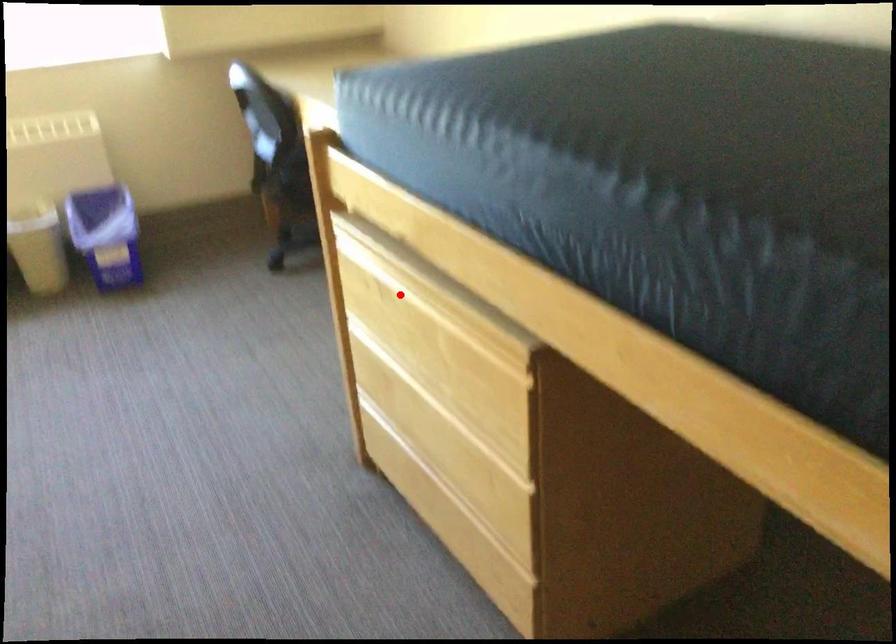
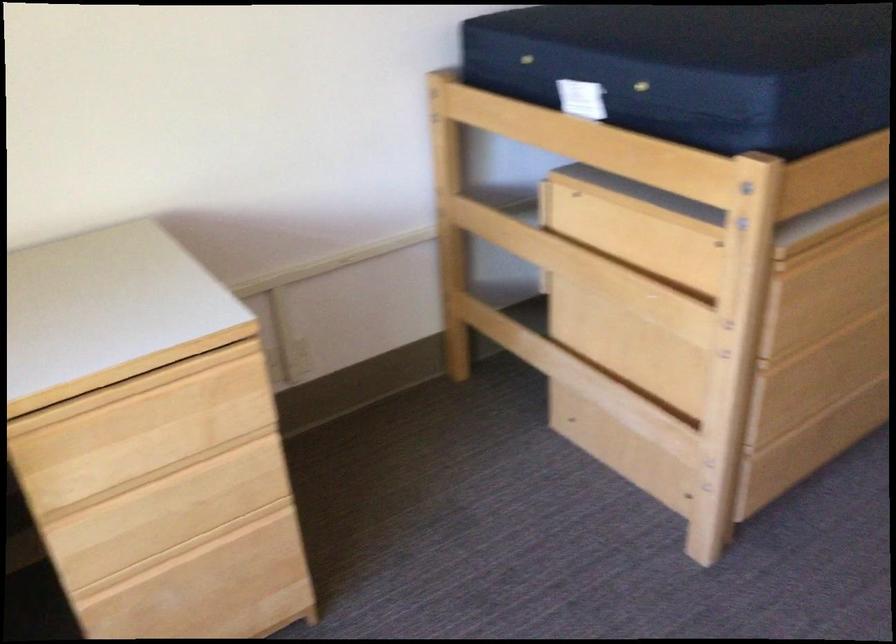
Locate, in the second image, the point that corresponds to the highlighted location in the first image.

(828, 240)